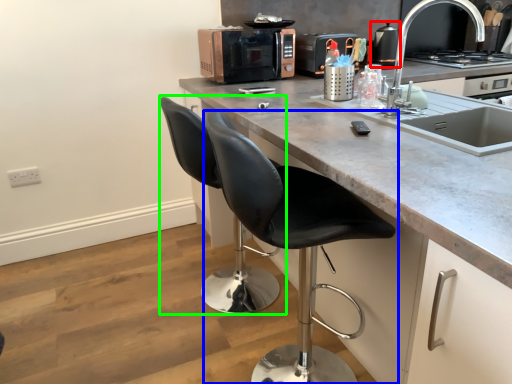
Question: Estimate the real-world distances between objects in this image. Which object is farther from appliance (highlighted by a red box), chair (highlighted by a blue box) or swivel chair (highlighted by a green box)?

Choices:
 (A) chair
 (B) swivel chair

Answer: (A)